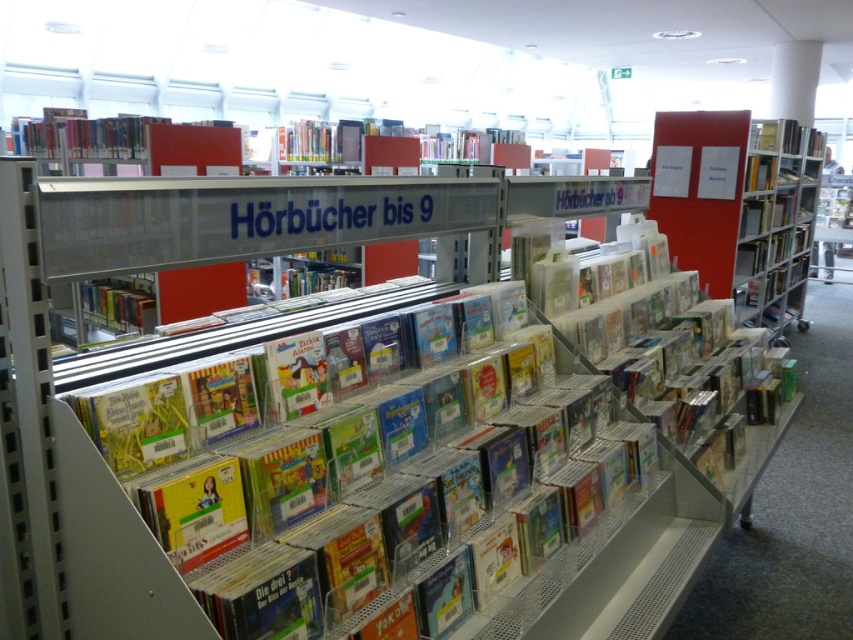
Question: Does matte plastic book at center come in front of matte plastic book at upper right?

Choices:
 (A) yes
 (B) no

Answer: (A)

Question: Considering the relative positions of matte plastic book at left and matte plastic book at upper right in the image provided, where is matte plastic book at left located with respect to matte plastic book at upper right?

Choices:
 (A) above
 (B) below

Answer: (B)

Question: Which object appears closest to the camera in this image?

Choices:
 (A) matte plastic book at left
 (B) metallic silver bookshelf at right
 (C) matte plastic book at upper right
 (D) matte plastic book at center

Answer: (D)

Question: Does matte plastic book at center have a smaller size compared to matte plastic book at upper right?

Choices:
 (A) yes
 (B) no

Answer: (A)

Question: Among these objects, which one is nearest to the camera?

Choices:
 (A) matte plastic book at upper right
 (B) matte plastic book at center
 (C) matte plastic book at left

Answer: (B)

Question: Which point appears farthest from the camera in this image?

Choices:
 (A) (764, 134)
 (B) (805, 180)
 (C) (108, 593)
 (D) (146, 292)

Answer: (B)